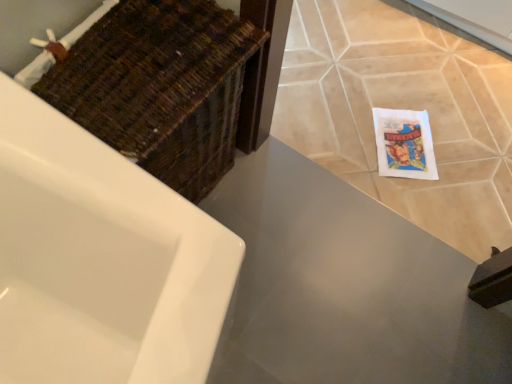
You are a GUI agent. You are given a task and a screenshot of the screen. Output one action in this format:
    pyautogui.click(x=<x>, y=<y>)
    Task: Click on the free space above matte gray countertop at center (from a real-world perspective)
    The width and height of the screenshot is (512, 384).
    Given the screenshot: What is the action you would take?
    pyautogui.click(x=327, y=292)